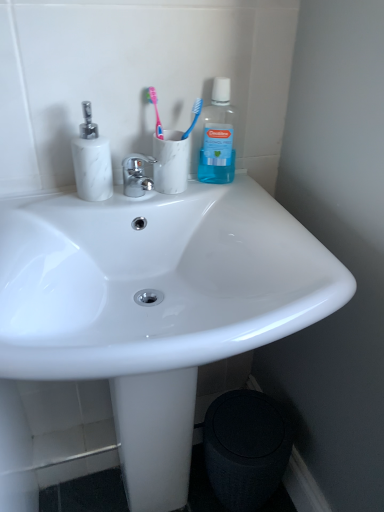
Image resolution: width=384 pixels, height=512 pixels. Identify the location of free point above black textured trash bin/can at lower right (from a real-world perspective). (247, 428).